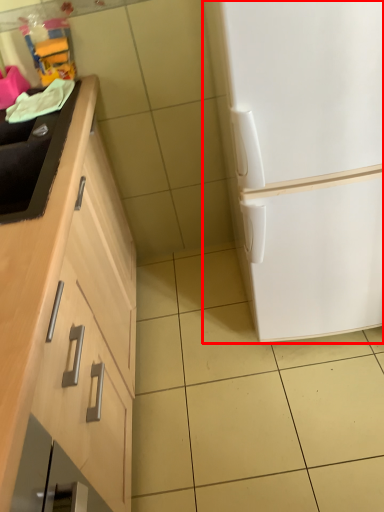
Question: From the image, what is the correct spatial relationship of refrigerator (annotated by the red box) in relation to sink?

Choices:
 (A) left
 (B) right

Answer: (B)